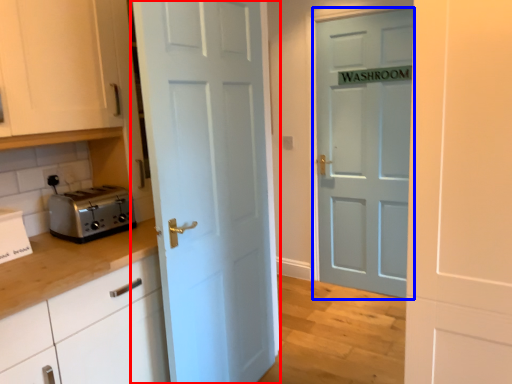
Question: Among these objects, which one is farthest to the camera, door (highlighted by a red box) or door (highlighted by a blue box)?

Choices:
 (A) door
 (B) door

Answer: (B)